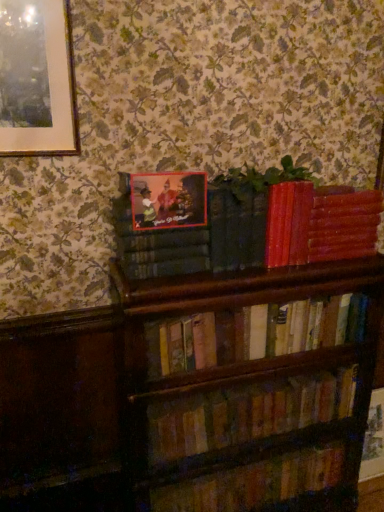
Question: Is matte plastic picture frame at upper center to the right of smooth red book at upper right, acting as the 4th book starting from the bottom, from the viewer's perspective?

Choices:
 (A) no
 (B) yes

Answer: (A)

Question: Is smooth red book at upper right, the 1th book from the top, surrounded by matte plastic picture frame at upper center?

Choices:
 (A) no
 (B) yes

Answer: (A)

Question: Is matte plastic picture frame at upper center far away from smooth red book at upper right, the 1th book from the top?

Choices:
 (A) no
 (B) yes

Answer: (A)

Question: Considering the relative sizes of matte plastic picture frame at upper center and smooth red book at upper right, acting as the 4th book starting from the bottom, in the image provided, is matte plastic picture frame at upper center thinner than smooth red book at upper right, acting as the 4th book starting from the bottom,?

Choices:
 (A) no
 (B) yes

Answer: (B)

Question: Can you confirm if matte plastic picture frame at upper center is wider than smooth red book at upper right, the 1th book from the top?

Choices:
 (A) no
 (B) yes

Answer: (A)

Question: Does matte plastic picture frame at upper center lie in front of smooth red book at upper right, acting as the 4th book starting from the bottom?

Choices:
 (A) no
 (B) yes

Answer: (B)

Question: From a real-world perspective, is green matte plant at upper center positioned under wooden bookshelf at lower center, the 3th book positioned from the top, based on gravity?

Choices:
 (A) no
 (B) yes

Answer: (A)

Question: Does green matte plant at upper center have a greater height compared to wooden bookshelf at lower center, arranged as the second book when ordered from the bottom?

Choices:
 (A) no
 (B) yes

Answer: (A)

Question: From the image's perspective, is green matte plant at upper center on wooden bookshelf at lower center, the 3th book positioned from the top?

Choices:
 (A) yes
 (B) no

Answer: (A)

Question: From a real-world perspective, is green matte plant at upper center over wooden bookshelf at lower center, the 3th book positioned from the top?

Choices:
 (A) no
 (B) yes

Answer: (B)

Question: Does green matte plant at upper center have a smaller size compared to wooden bookshelf at lower center, the 3th book positioned from the top?

Choices:
 (A) yes
 (B) no

Answer: (A)

Question: Is green matte plant at upper center bigger than wooden bookshelf at lower center, the 3th book positioned from the top?

Choices:
 (A) no
 (B) yes

Answer: (A)

Question: Does wooden book at lower center, which ranks as the first book in bottom-to-top order, have a larger size compared to wooden bookshelf at center, the second book viewed from the top?

Choices:
 (A) yes
 (B) no

Answer: (B)